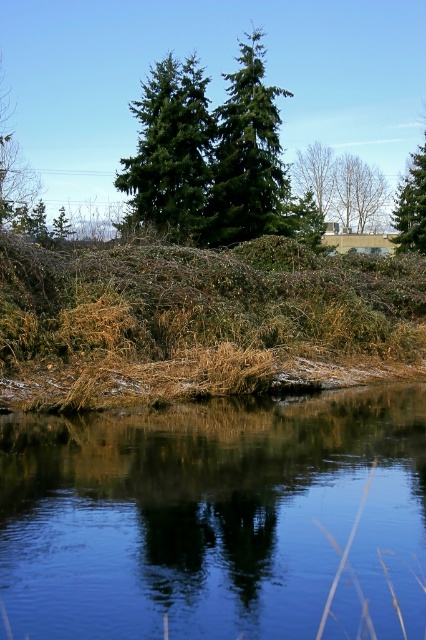
Is point (276, 186) closer to viewer compared to point (298, 154)?

Yes, it is in front of point (298, 154).

Does green matte tree at center appear on the left side of brown leafy tree at upper center?

Indeed, green matte tree at center is positioned on the left side of brown leafy tree at upper center.

Locate an element on the screen. green matte tree at center is located at coordinates (247, 156).

Who is taller, green matte evergreen tree at upper center or brown leafy tree at upper center?

green matte evergreen tree at upper center

Is green matte evergreen tree at upper center closer to camera compared to brown leafy tree at upper center?

Yes, it is.

What do you see at coordinates (172, 154) in the screenshot? I see `green matte evergreen tree at upper center` at bounding box center [172, 154].

The image size is (426, 640). I want to click on green matte evergreen tree at upper center, so click(x=172, y=154).

In the scene shown: Is clear water at lower center closer to camera compared to green matte tree at center?

That is True.

Image resolution: width=426 pixels, height=640 pixels. Find the location of `clear water at lower center`. clear water at lower center is located at coordinates (215, 518).

Which is behind, point (52, 422) or point (275, 152)?

Point (275, 152)

Locate an element on the screen. clear water at lower center is located at coordinates (215, 518).